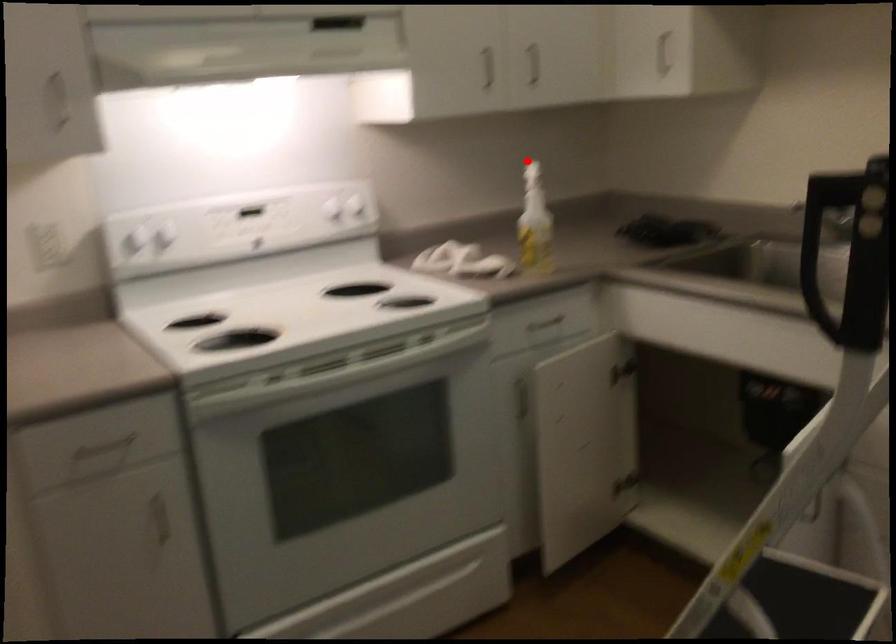
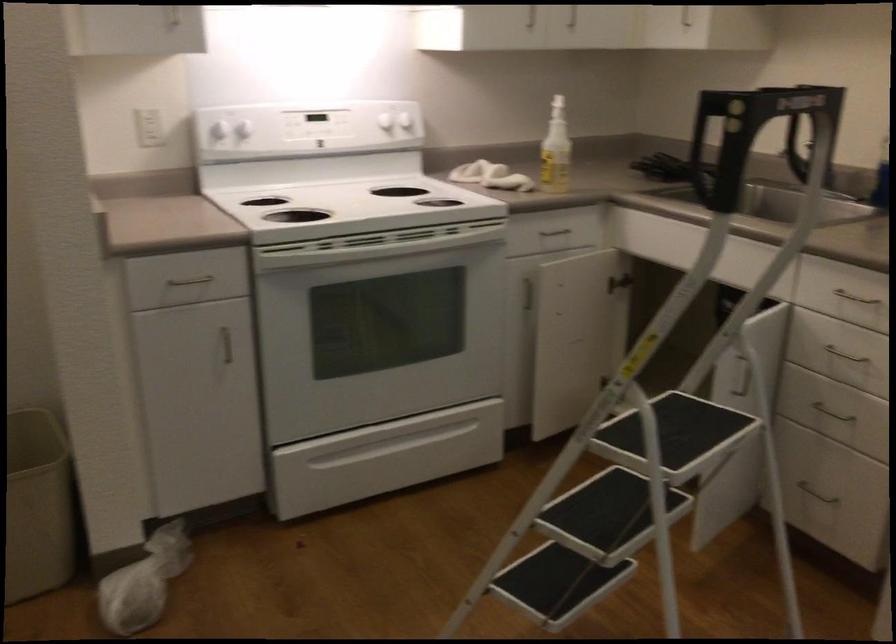
Locate, in the second image, the point that corresponds to the highlighted location in the first image.

(557, 97)